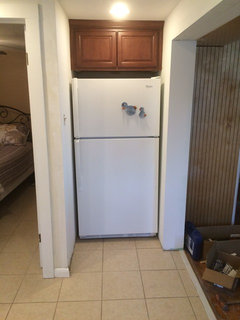
You are a GUI agent. You are given a task and a screenshot of the screen. Output one action in this format:
    pyautogui.click(x=<x>, y=<y>)
    Task: Click on the bed frame
    This screenshot has height=320, width=240.
    Given the screenshot: What is the action you would take?
    pyautogui.click(x=9, y=198)